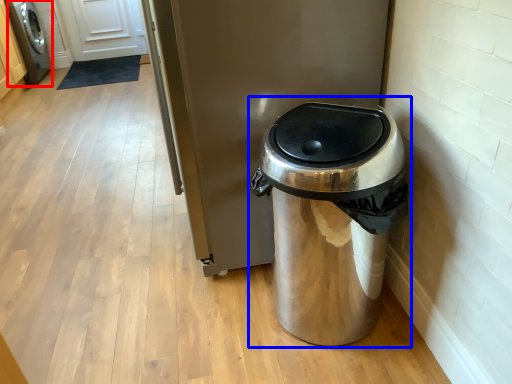
Question: Which point is closer to the camera, washing machine (highlighted by a red box) or waste container (highlighted by a blue box)?

Choices:
 (A) washing machine
 (B) waste container

Answer: (B)